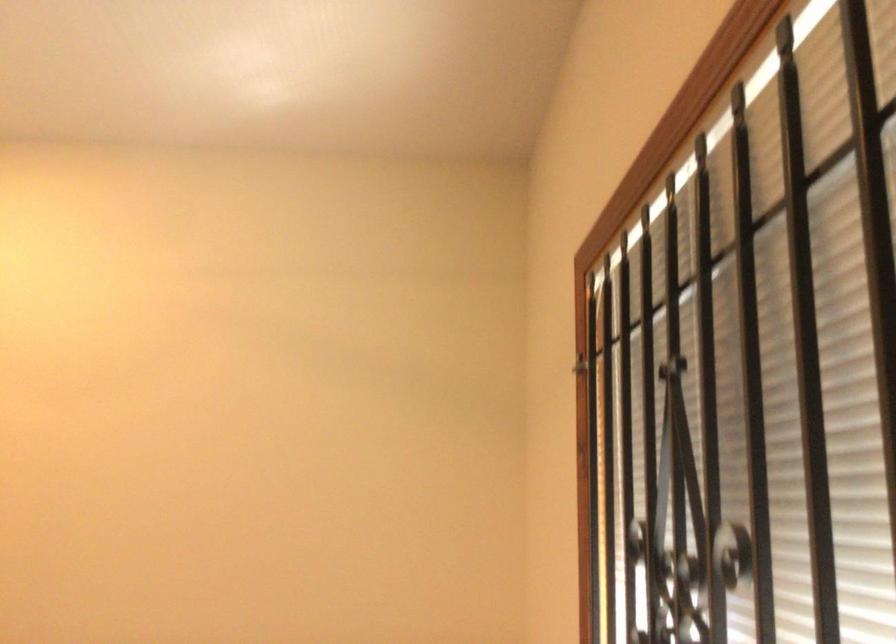
Find where to pull the metal gate latch. Please return your answer as a coordinate pair (x, y).

(579, 364)